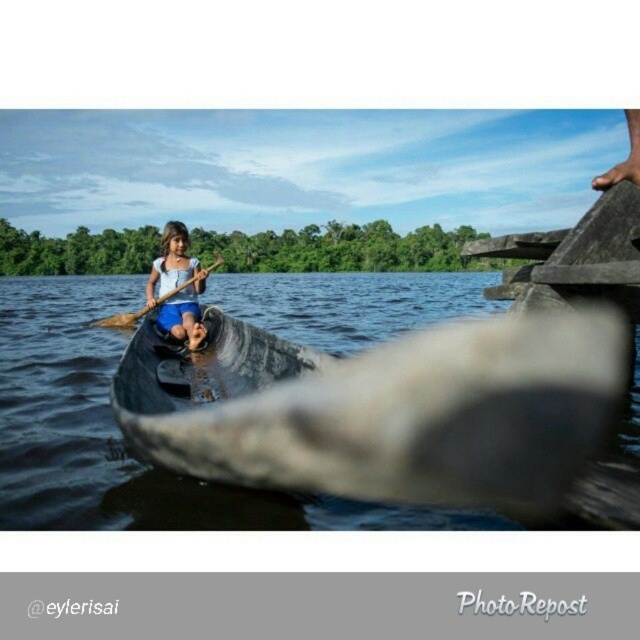
Between matte blue dress at center and wooden at left, which one is positioned higher?

Positioned higher is wooden at left.

Who is positioned more to the right, matte blue dress at center or wooden at left?

matte blue dress at center

Who is more distant from viewer, (204,285) or (216,256)?

The point (216,256) is behind.

At what (x,y) coordinates should I click in order to perform the action: click on matte blue dress at center. Please return your answer as a coordinate pair (x, y). Looking at the image, I should click on (177, 288).

Who is positioned more to the left, dark gray wooden canoe at center or matte blue dress at center?

matte blue dress at center

Is point (221, 420) positioned behind point (157, 275)?

That is False.

This screenshot has width=640, height=640. I want to click on dark gray wooden canoe at center, so click(x=394, y=413).

Between dark gray wooden canoe at center and wooden at left, which one is positioned lower?

Positioned lower is dark gray wooden canoe at center.

Image resolution: width=640 pixels, height=640 pixels. Describe the element at coordinates (394, 413) in the screenshot. I see `dark gray wooden canoe at center` at that location.

Identify the location of dark gray wooden canoe at center. (394, 413).